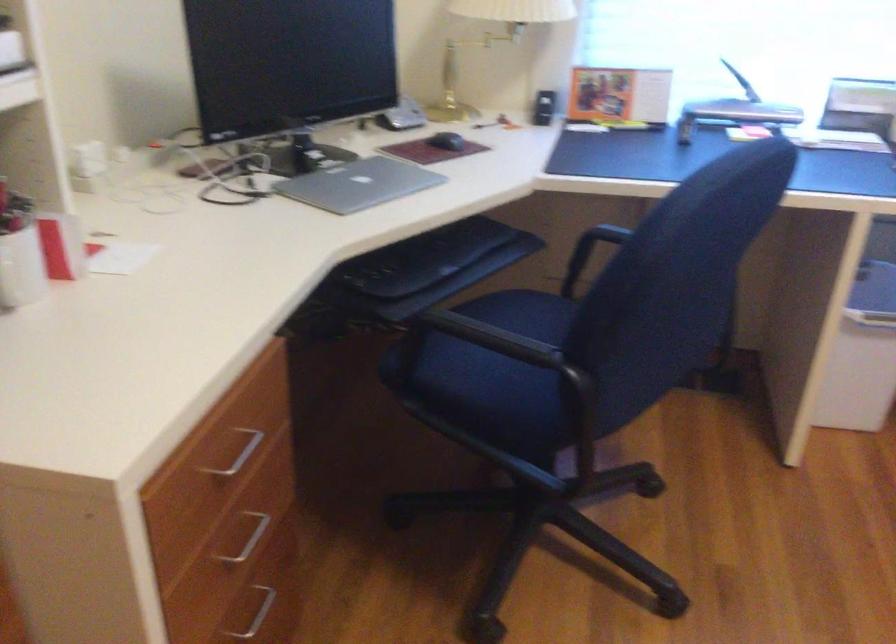
Where is `black keyboard tray`? The height and width of the screenshot is (644, 896). black keyboard tray is located at coordinates (425, 258).